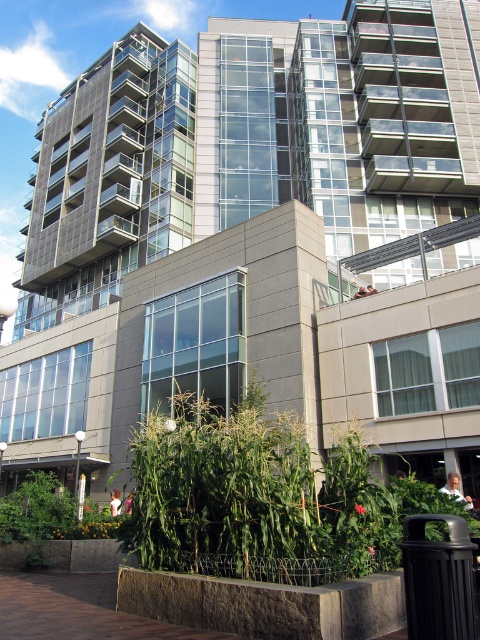
You are standing in front of the modern building and want to take a photo that includes both the tall plants in the garden and the glass facade. Which point, point (335, 452) or point (71, 532), is closer to your camera position?

Point (335, 452) is closer to the camera than point (71, 532), so it will appear larger in the photo.

You are a landscape architect designing a garden path between the green leafy plant at lower center and the green leafy plant at lower left. Since the plants have different heights, which plant should you place a taller decorative stone next to to balance the composition?

The green leafy plant at lower center is shorter than the green leafy plant at lower left, so you should place the taller decorative stone next to the green leafy plant at lower center to balance the composition.

You are standing in the garden area in front of the modern building. You see a point marked at coordinate (x=262, y=497). What is located at that point?

The point at coordinate (x=262, y=497) indicates a green leafy plant at lower center.